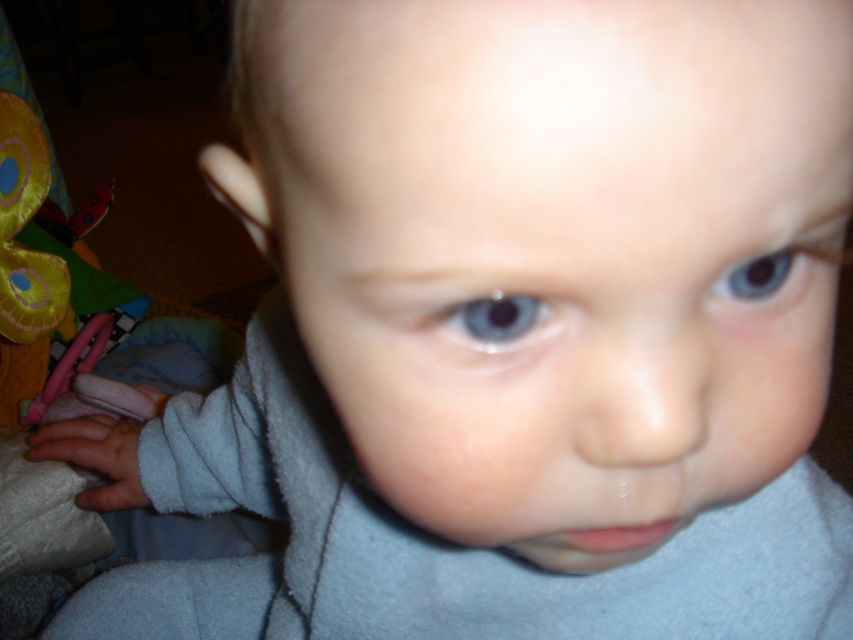
Question: Is blue glossy eye at center further to camera compared to blue glossy eye at upper center?

Choices:
 (A) yes
 (B) no

Answer: (B)

Question: Can you confirm if blue glossy eye at center is positioned to the right of blue glossy eye at upper center?

Choices:
 (A) yes
 (B) no

Answer: (B)

Question: Which point is farther from the camera taking this photo?

Choices:
 (A) (503, 317)
 (B) (764, 289)

Answer: (B)

Question: Does blue glossy eye at center appear on the right side of blue glossy eye at upper center?

Choices:
 (A) yes
 (B) no

Answer: (B)

Question: Which point is farther to the camera?

Choices:
 (A) blue glossy eye at center
 (B) blue glossy eye at upper center

Answer: (B)

Question: Which object appears closest to the camera in this image?

Choices:
 (A) blue glossy eye at upper center
 (B) blue glossy eye at center

Answer: (B)